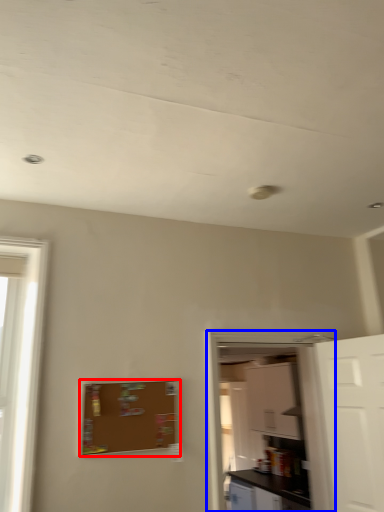
Question: Among these objects, which one is farthest to the camera, bulletin board (highlighted by a red box) or screen door (highlighted by a blue box)?

Choices:
 (A) bulletin board
 (B) screen door

Answer: (B)